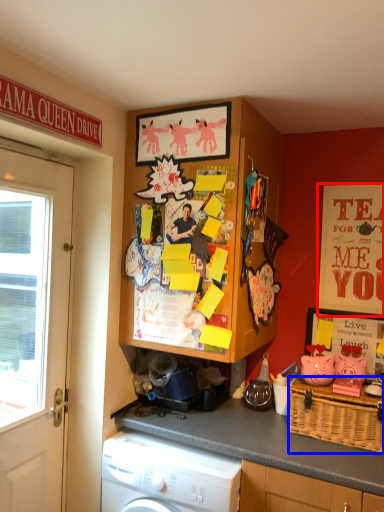
Question: Which object appears farthest to the camera in this image, advertisement (highlighted by a red box) or picnic basket (highlighted by a blue box)?

Choices:
 (A) advertisement
 (B) picnic basket

Answer: (A)